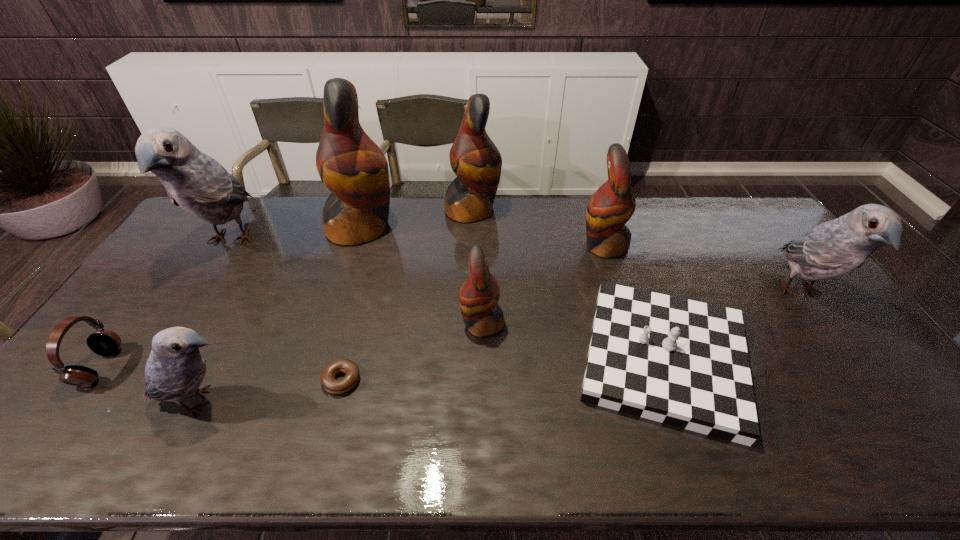
Where is `the smallest red parrot`? The height and width of the screenshot is (540, 960). the smallest red parrot is located at coordinates coord(479,294).

This screenshot has width=960, height=540. What are the coordinates of `headset` in the screenshot? It's located at (x=103, y=342).

Locate an element on the screen. The image size is (960, 540). the third shortest object is located at coordinates (103, 342).

This screenshot has height=540, width=960. Identify the location of checkerboard. (681, 362).

Locate an element on the screen. the ninth tallest object is located at coordinates (681, 362).

The image size is (960, 540). What are the coordinates of `brown doughnut` in the screenshot? It's located at (336, 386).

Identify the location of doughnut. This screenshot has width=960, height=540. (336, 386).

At what (x,y) coordinates should I click in order to perform the action: click on vacant space located on the face of the fifth parrot from right to left. Please return your answer as a coordinate pair (x, y). Image resolution: width=960 pixels, height=540 pixels. Looking at the image, I should click on (458, 228).

At what (x,y) coordinates should I click in order to perform the action: click on vacant region located on the face of the third smallest red parrot. Please return your answer as a coordinate pair (x, y). This screenshot has height=540, width=960. Looking at the image, I should click on (559, 210).

Locate an element on the screen. vacant space located 0.260m on the front-facing side of the biggest gray parrot is located at coordinates (162, 347).